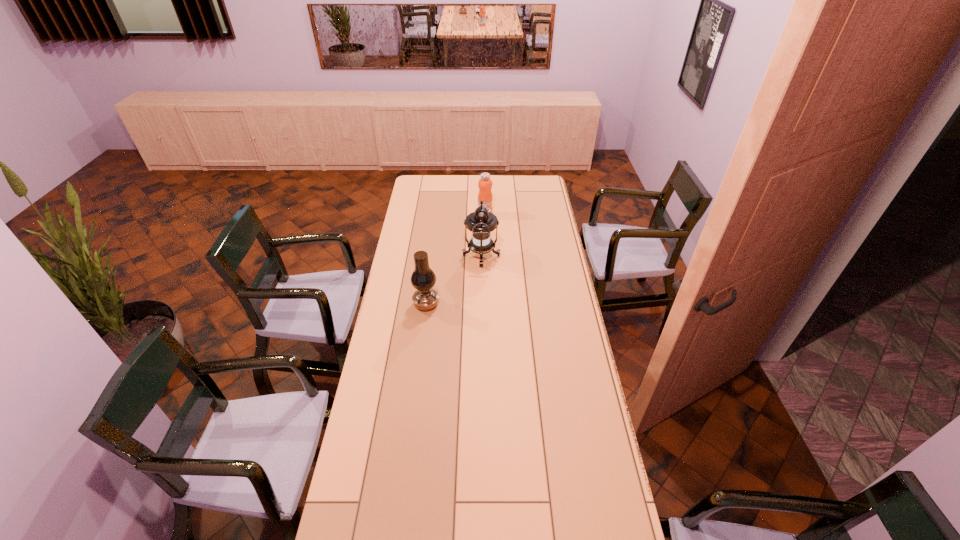
Image resolution: width=960 pixels, height=540 pixels. Find the location of `vacant position at the right edge of the desktop`. vacant position at the right edge of the desktop is located at coordinates (601, 528).

I want to click on vacant space at the far left corner of the desktop, so click(x=413, y=188).

Where is `vacant space that's between the fruit juice and the leftmost object`? vacant space that's between the fruit juice and the leftmost object is located at coordinates (456, 260).

Where is `vacant space that is in between the leftmost object and the second farthest object`? This screenshot has height=540, width=960. vacant space that is in between the leftmost object and the second farthest object is located at coordinates (454, 280).

I want to click on free space between the leftmost object and the second farthest object, so click(x=454, y=280).

You are a GUI agent. You are given a task and a screenshot of the screen. Output one action in this format:
    pyautogui.click(x=<x>, y=<y>)
    Task: Click on the vacant area that lies between the second farthest object and the oil lamp
    
    Given the screenshot: What is the action you would take?
    point(454,280)

Locate an element on the screen. Image resolution: width=960 pixels, height=540 pixels. vacant region between the second nearest object and the nearest object is located at coordinates (454, 280).

I want to click on unoccupied position between the leftmost object and the farthest object, so click(456, 260).

Where is `the second closest object to the farthest object`? the second closest object to the farthest object is located at coordinates (423, 278).

At what (x,y) coordinates should I click in order to perform the action: click on object identified as the second closest to the leftmost object. Please return your answer as a coordinate pair (x, y). Image resolution: width=960 pixels, height=540 pixels. Looking at the image, I should click on (485, 183).